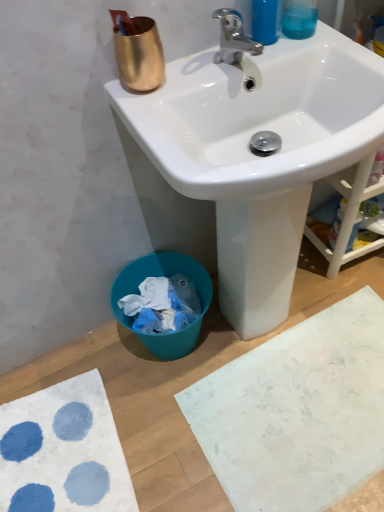
Identify the location of free spot to the right of chrome metallic faucet at upper center. Image resolution: width=384 pixels, height=512 pixels. (294, 47).